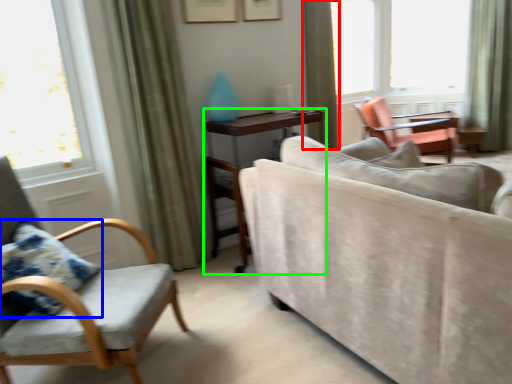
Question: Which object is positioned farthest from curtain (highlighted by a red box)? Select from pillow (highlighted by a blue box) and table (highlighted by a green box).

Choices:
 (A) pillow
 (B) table

Answer: (A)